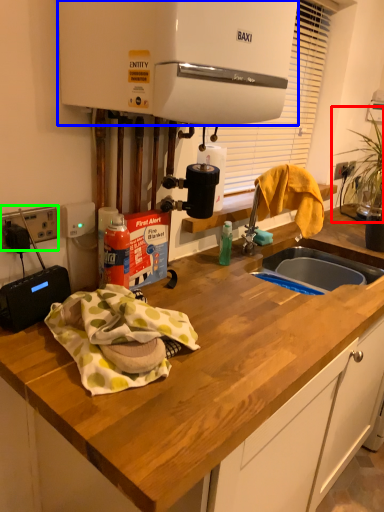
Question: Which object is the closest to the plant (highlighted by a red box)? Choose among these: home appliance (highlighted by a blue box) or electric outlet (highlighted by a green box).

Choices:
 (A) home appliance
 (B) electric outlet

Answer: (A)